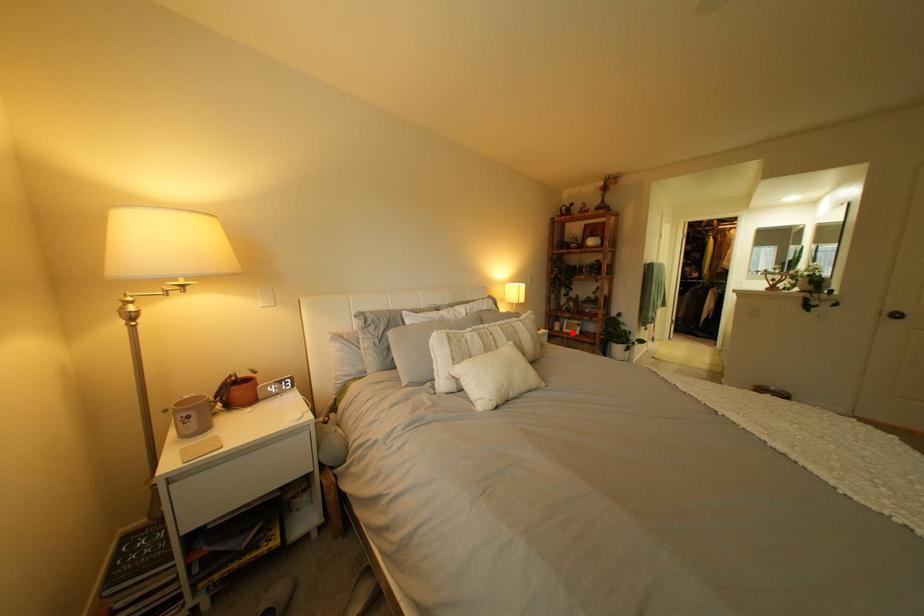
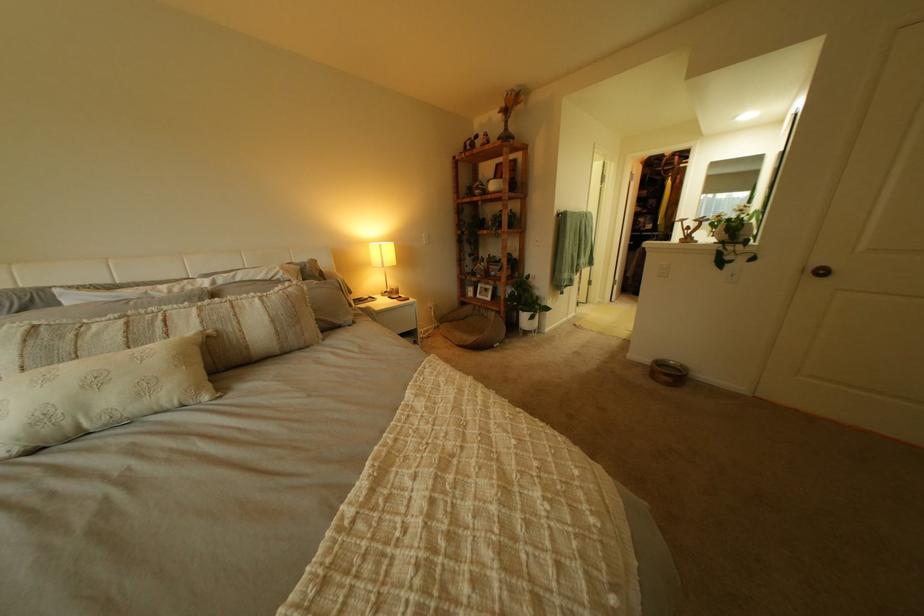
Question: I am providing you with two images of the same scene from different viewpoints. Image1 has a red point marked. In image2, the corresponding 3D location appears at what relative position? Reply with the corresponding letter.

Choices:
 (A) Closer
 (B) Farther

Answer: (A)